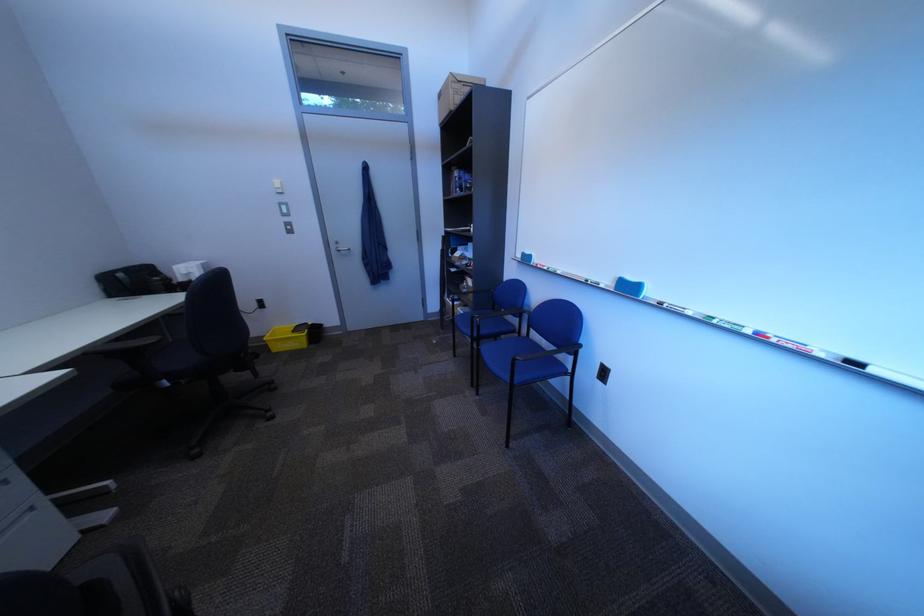
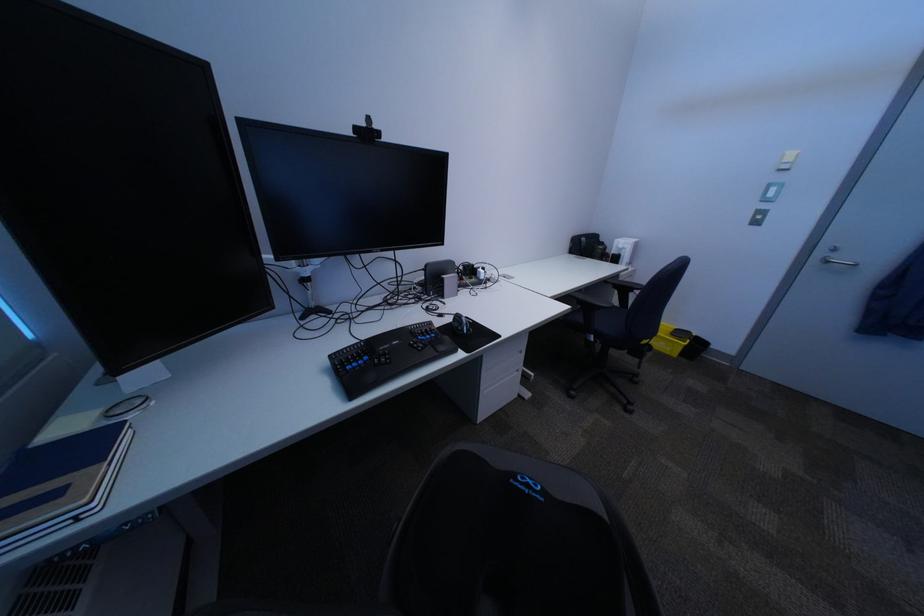
The first image is from the beginning of the video and the second image is from the end. How did the camera likely rotate when shooting the video?

The camera rotated toward left-down.